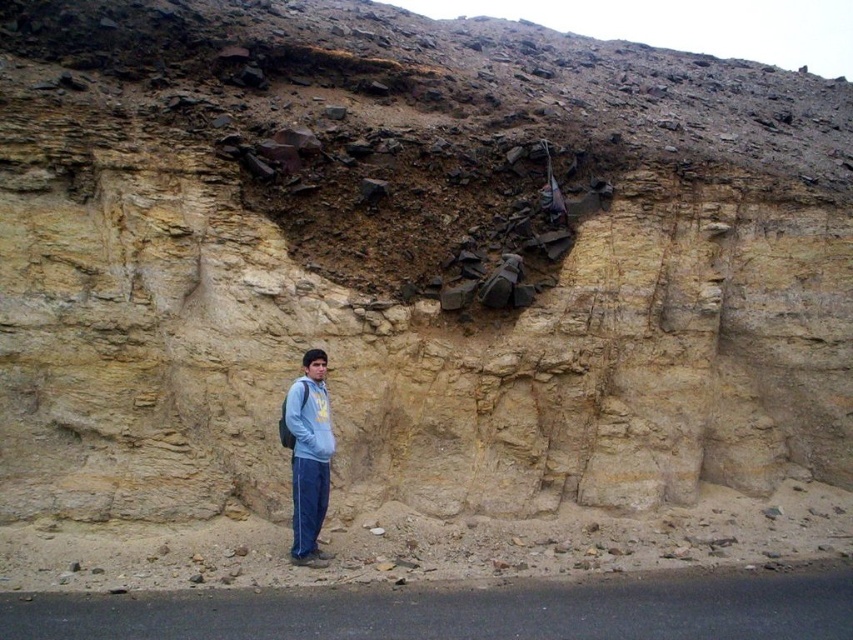
Question: Can you confirm if light blue denim pants at lower left is positioned to the right of light blue fleece sweatshirt at lower center?

Choices:
 (A) yes
 (B) no

Answer: (B)

Question: Among these points, which one is nearest to the camera?

Choices:
 (A) (312, 449)
 (B) (294, 387)

Answer: (A)

Question: Is light blue denim pants at lower left to the right of light blue fleece sweatshirt at lower center from the viewer's perspective?

Choices:
 (A) yes
 (B) no

Answer: (B)

Question: Which point is closer to the camera taking this photo?

Choices:
 (A) tap(310, 401)
 (B) tap(289, 390)

Answer: (A)

Question: Can you confirm if light blue denim pants at lower left is positioned below light blue fleece sweatshirt at lower center?

Choices:
 (A) no
 (B) yes

Answer: (B)